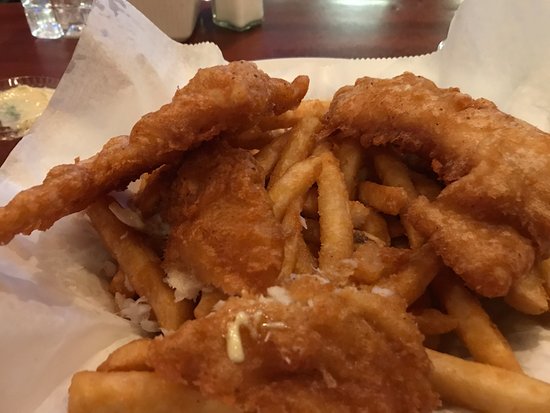
You are a GUI agent. You are given a task and a screenshot of the screen. Output one action in this format:
    pyautogui.click(x=<x>, y=<y>)
    Task: Click on the table
    
    Given the screenshot: What is the action you would take?
    click(292, 20)